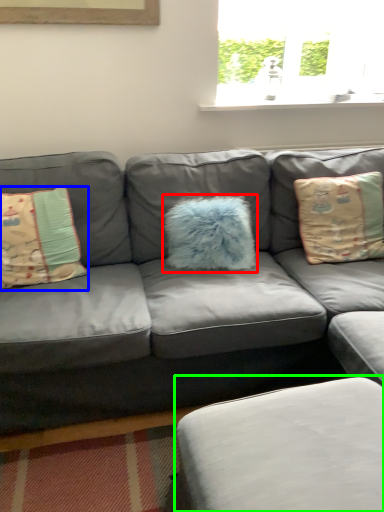
Question: Which object is positioned farthest from pillow (highlighted by a red box)? Select from pillow (highlighted by a blue box) and footrest (highlighted by a green box).

Choices:
 (A) pillow
 (B) footrest

Answer: (B)